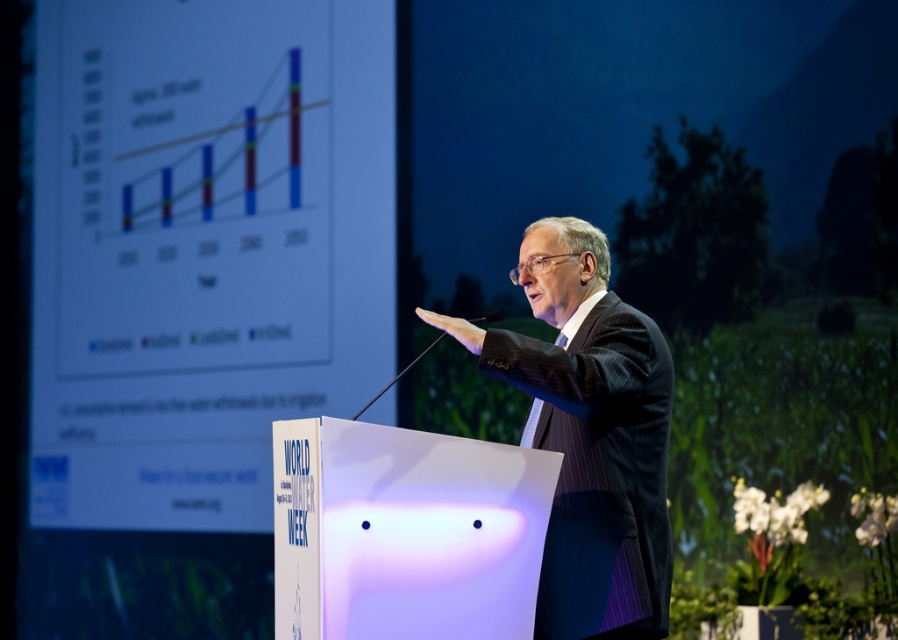
Question: Considering the relative positions of matte white screen at upper left and dark suit at center in the image provided, where is matte white screen at upper left located with respect to dark suit at center?

Choices:
 (A) below
 (B) above

Answer: (B)

Question: Is matte white screen at upper left smaller than dark suit at center?

Choices:
 (A) no
 (B) yes

Answer: (A)

Question: Among these objects, which one is farthest from the camera?

Choices:
 (A) matte white screen at upper left
 (B) dark suit at center

Answer: (A)

Question: Is matte white screen at upper left to the right of dark suit at center from the viewer's perspective?

Choices:
 (A) yes
 (B) no

Answer: (B)

Question: Which point is farther to the camera?

Choices:
 (A) (476, 342)
 (B) (236, 161)

Answer: (B)